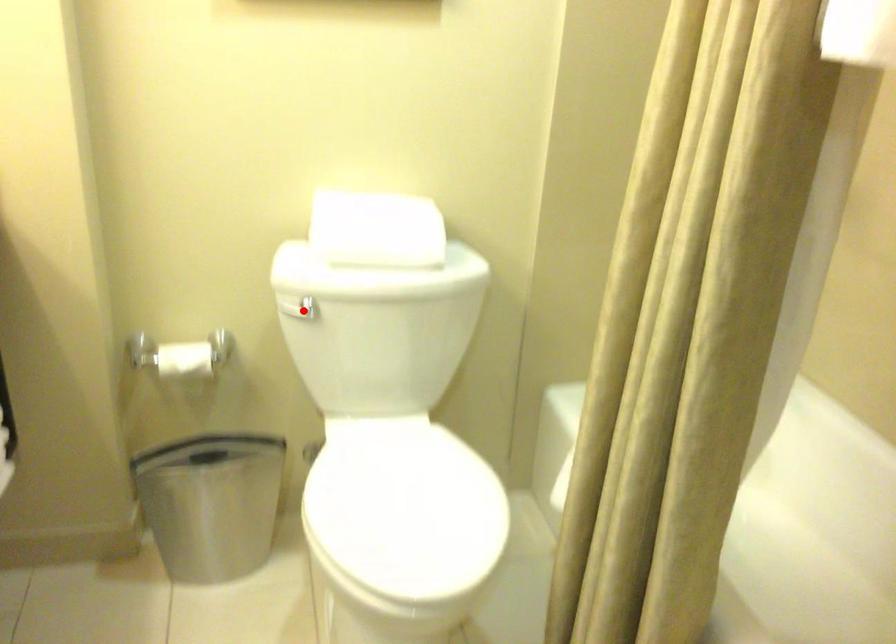
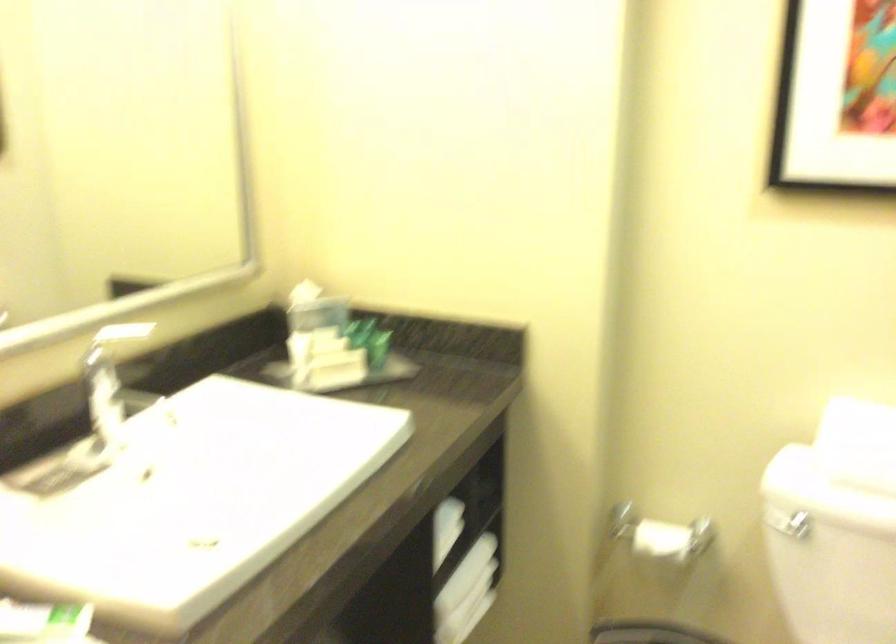
Where in the second image is the point corresponding to the highlighted location from the first image?

(788, 524)